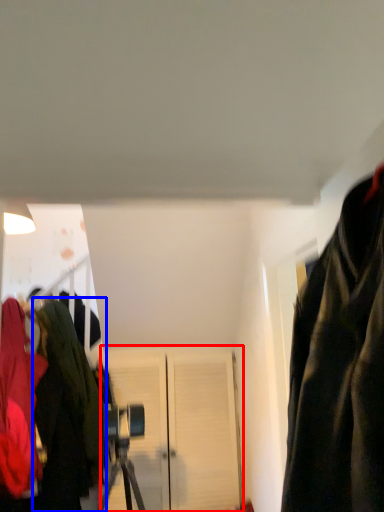
Question: Which object is closer to the camera taking this photo, door (highlighted by a red box) or jacket (highlighted by a blue box)?

Choices:
 (A) door
 (B) jacket

Answer: (B)